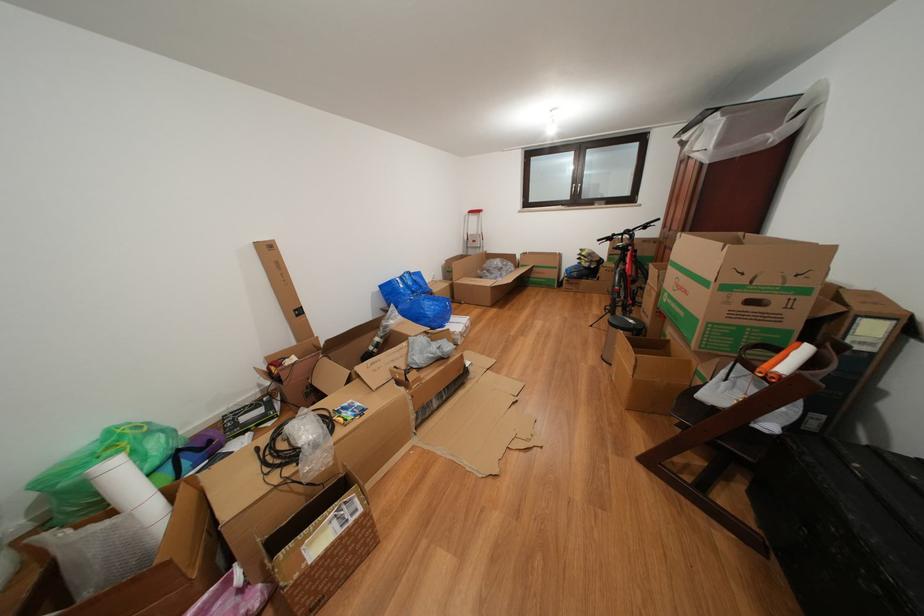
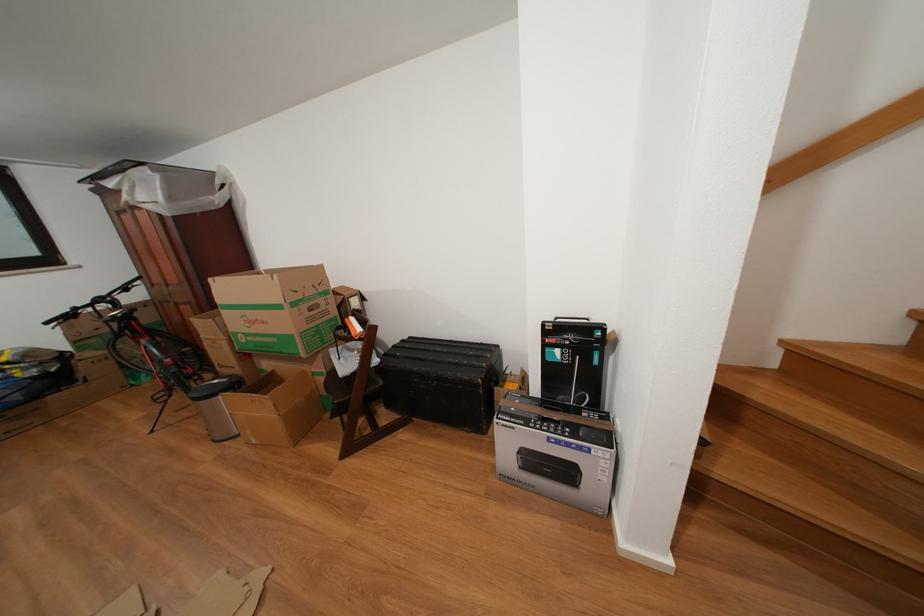
Find the pixel in the second image that matches the point at 709,408 in the first image.

(354, 383)